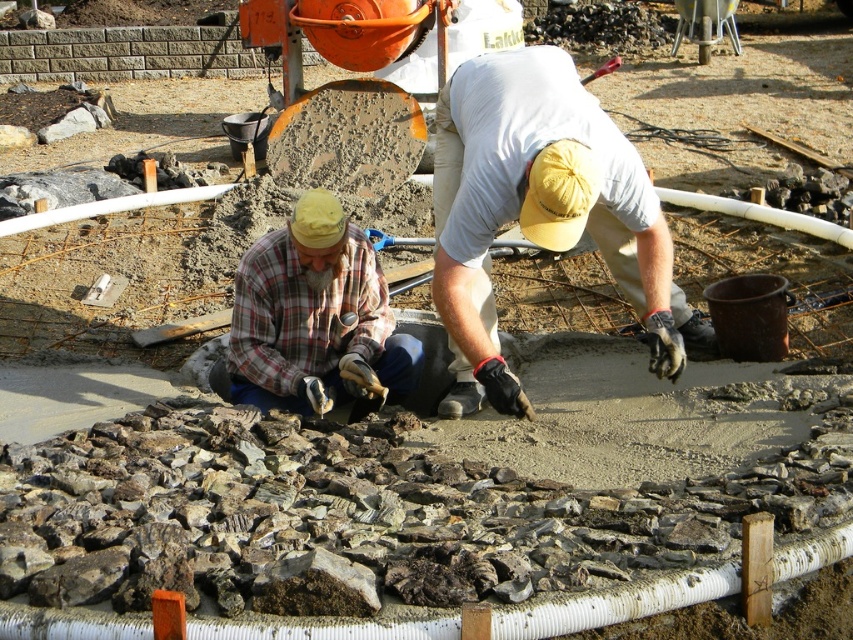
Does light blue cotton shirt at center appear over plaid fabric shirt at center?

Yes.

Is light blue cotton shirt at center wider than plaid fabric shirt at center?

Yes.

Identify the location of light blue cotton shirt at center. The image size is (853, 640). (538, 209).